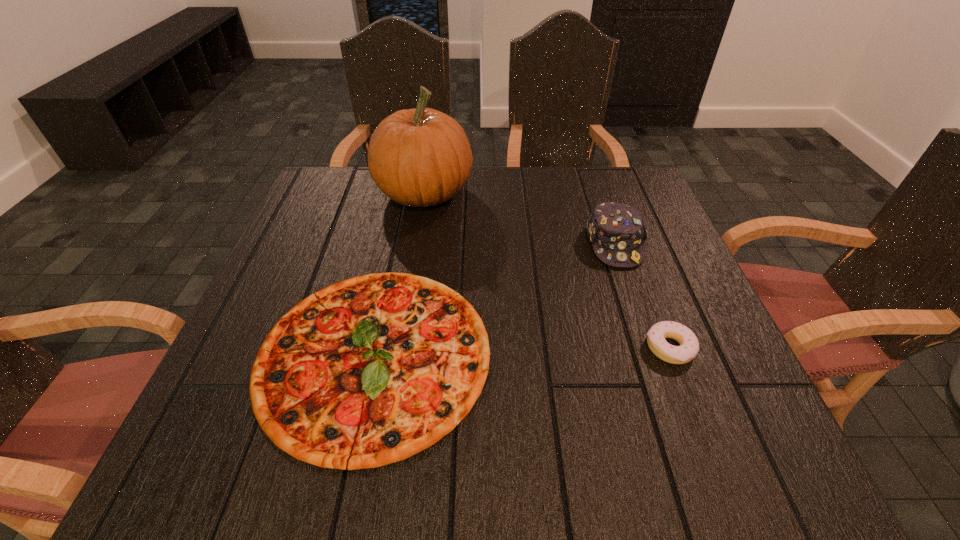
In order to click on pumpkin in this screenshot , I will do `click(421, 157)`.

Where is `the third shortest object`? This screenshot has width=960, height=540. the third shortest object is located at coordinates (617, 231).

Identify the location of doughnut. (689, 346).

The height and width of the screenshot is (540, 960). I want to click on pizza, so click(371, 370).

The height and width of the screenshot is (540, 960). Find the location of `vacant area situated 0.360m on the stem of the tallest object`. vacant area situated 0.360m on the stem of the tallest object is located at coordinates (606, 194).

This screenshot has width=960, height=540. In order to click on free space located 0.220m on the front-facing side of the second tallest object in this screenshot , I will do `click(651, 350)`.

Identify the location of vacant space located on the back of the third tallest object. This screenshot has width=960, height=540. (645, 282).

Where is `vacant area situated on the right of the pizza`? vacant area situated on the right of the pizza is located at coordinates (565, 354).

At what (x,y) coordinates should I click in order to perform the action: click on object that is at the far edge. Please return your answer as a coordinate pair (x, y). Looking at the image, I should click on (421, 157).

Where is `object that is at the near edge`? object that is at the near edge is located at coordinates (371, 370).